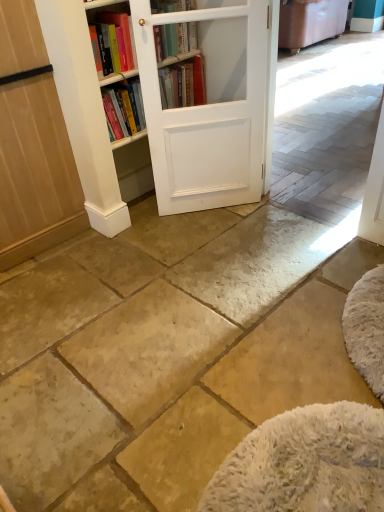
Question: Is white matte barn door at center behind natural stone floor at center?

Choices:
 (A) yes
 (B) no

Answer: (A)

Question: Is white matte barn door at center bigger than natural stone floor at center?

Choices:
 (A) yes
 (B) no

Answer: (B)

Question: Is the surface of white matte barn door at center in direct contact with natural stone floor at center?

Choices:
 (A) yes
 (B) no

Answer: (B)

Question: From the image's perspective, is white matte barn door at center located above natural stone floor at center?

Choices:
 (A) yes
 (B) no

Answer: (A)

Question: Does white matte barn door at center have a greater width compared to natural stone floor at center?

Choices:
 (A) no
 (B) yes

Answer: (A)

Question: Is white matte barn door at center at the left side of natural stone floor at center?

Choices:
 (A) yes
 (B) no

Answer: (B)

Question: Considering the relative sizes of white matte barn door at center and white wood bookcase at center in the image provided, is white matte barn door at center shorter than white wood bookcase at center?

Choices:
 (A) yes
 (B) no

Answer: (B)

Question: Considering the relative sizes of white matte barn door at center and white wood bookcase at center in the image provided, is white matte barn door at center bigger than white wood bookcase at center?

Choices:
 (A) no
 (B) yes

Answer: (A)

Question: Is white matte barn door at center far from white wood bookcase at center?

Choices:
 (A) yes
 (B) no

Answer: (B)

Question: From the image's perspective, is white matte barn door at center located beneath white wood bookcase at center?

Choices:
 (A) yes
 (B) no

Answer: (A)

Question: Could you tell me if white matte barn door at center is turned towards white wood bookcase at center?

Choices:
 (A) no
 (B) yes

Answer: (A)

Question: Is white matte barn door at center taller than white wood bookcase at center?

Choices:
 (A) yes
 (B) no

Answer: (A)

Question: Is white wood bookcase at center not within white matte barn door at center?

Choices:
 (A) yes
 (B) no

Answer: (A)